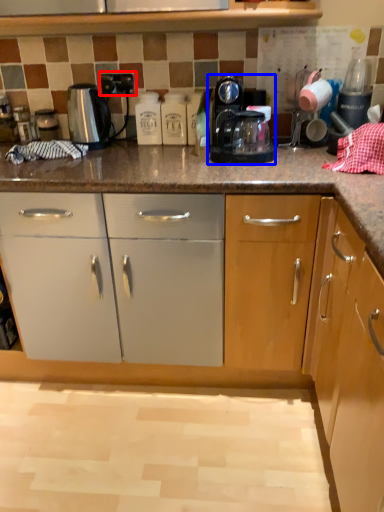
Question: Which object is closer to the camera taking this photo, electric outlet (highlighted by a red box) or home appliance (highlighted by a blue box)?

Choices:
 (A) electric outlet
 (B) home appliance

Answer: (B)